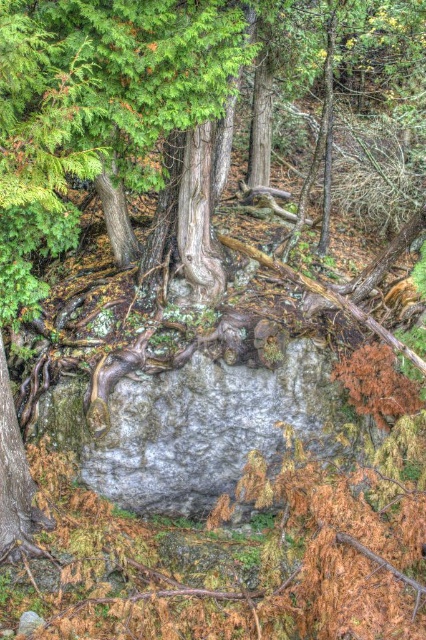
Which is below, smooth gray bark at center or smooth gray bark at lower left?

smooth gray bark at lower left is lower down.

From the picture: Can you confirm if smooth gray bark at center is smaller than smooth gray bark at lower left?

No.

Does point (192, 252) come closer to viewer compared to point (0, 536)?

No, (192, 252) is behind (0, 536).

Image resolution: width=426 pixels, height=640 pixels. Find the location of `smooth gray bark at center`. smooth gray bark at center is located at coordinates (198, 220).